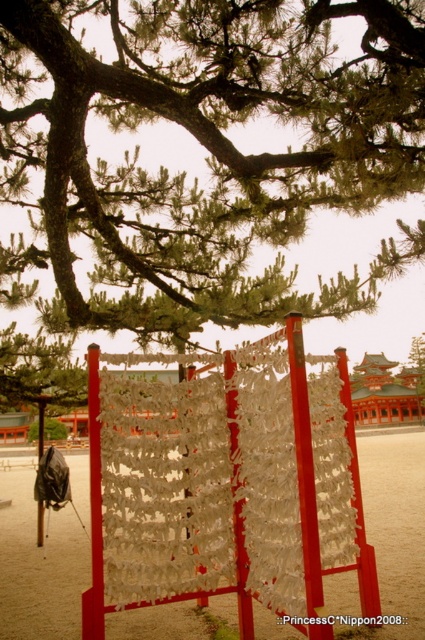
Question: Which object is closer to the camera taking this photo?

Choices:
 (A) green leafy tree at upper center
 (B) sandy beige sand at lower center

Answer: (B)

Question: Is green leafy tree at upper center wider than sandy beige sand at lower center?

Choices:
 (A) no
 (B) yes

Answer: (A)

Question: Does green leafy tree at upper center appear on the right side of sandy beige sand at lower center?

Choices:
 (A) no
 (B) yes

Answer: (A)

Question: Which object appears farthest from the camera in this image?

Choices:
 (A) green leafy tree at upper center
 (B) sandy beige sand at lower center

Answer: (A)

Question: From the image, what is the correct spatial relationship of green leafy tree at upper center in relation to sandy beige sand at lower center?

Choices:
 (A) right
 (B) left

Answer: (B)

Question: Among these points, which one is farthest from the camera?

Choices:
 (A) (382, 442)
 (B) (79, 310)

Answer: (A)